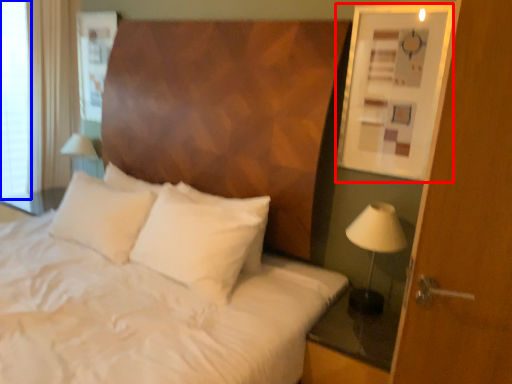
Question: Which object appears closest to the camera in this image, picture frame (highlighted by a red box) or window screen (highlighted by a blue box)?

Choices:
 (A) picture frame
 (B) window screen

Answer: (A)